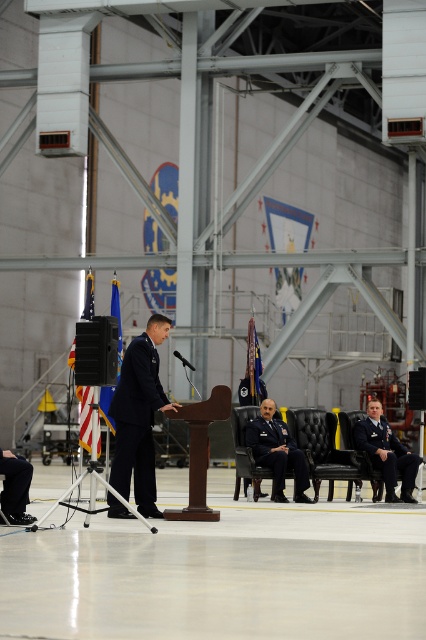
Based on the coordinates provided, where exactly is the dark blue fabric uniform at center located in the image?

The dark blue fabric uniform at center is located at the coordinates point (278, 454).

From the picture: You are a photographer at the event and need to capture a photo that includes both the navy blue fabric uniform at center and the black matte uniform at lower right. Which uniform should you focus on first to ensure both are in frame?

The navy blue fabric uniform at center is positioned over the black matte uniform at lower right, so focusing on the navy blue fabric uniform at center first will ensure both are in frame.

You are an event planner observing the scene. You need to arrange a new speaker who will stand behind the podium. The new speaker is taller than the current speaker. Considering the positioning of the navy blue fabric uniform at center and the dark blue fabric uniform at center, which uniform should the new speaker wear to maintain visual hierarchy?

The navy blue fabric uniform at center is in front of the dark blue fabric uniform at center. To maintain visual hierarchy, the new speaker should wear the navy blue fabric uniform at center as it is positioned closer to the audience, ensuring prominence.